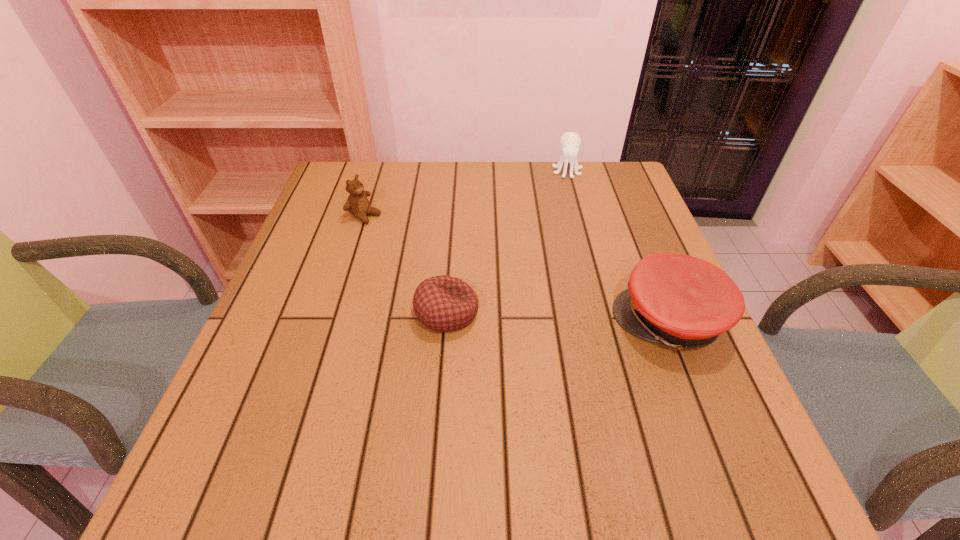
You are a GUI agent. You are given a task and a screenshot of the screen. Output one action in this format:
    pyautogui.click(x=<x>, y=<y>)
    Task: Click on the vacant space on the desktop that is between the third object from right to left and the cap and is positioned at the face of the leftmost object
    
    Given the screenshot: What is the action you would take?
    pyautogui.click(x=590, y=318)

At what (x,y) coordinates should I click in order to perform the action: click on free space on the desktop that is between the shortest object and the cap and is positioned on the front-facing side of the farthest object. Please return your answer as a coordinate pair (x, y). This screenshot has height=540, width=960. Looking at the image, I should click on (578, 318).